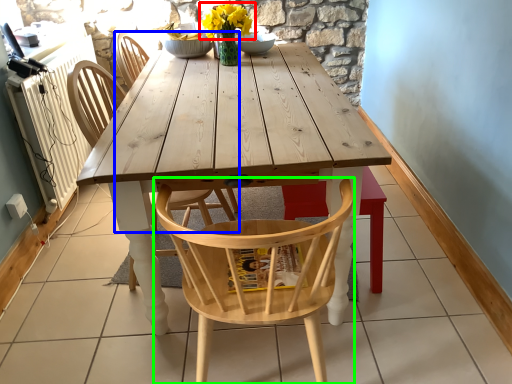
Question: Estimate the real-world distances between objects in this image. Which object is farther from flower (highlighted by a red box), chair (highlighted by a blue box) or chair (highlighted by a green box)?

Choices:
 (A) chair
 (B) chair

Answer: (B)